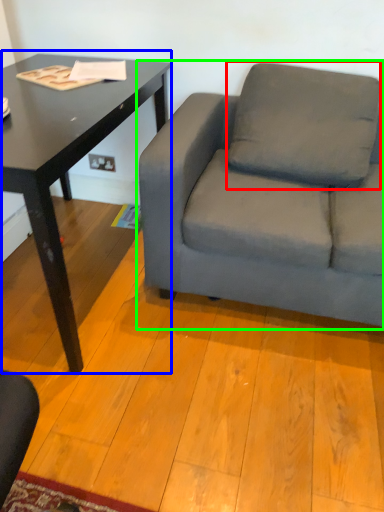
Question: Estimate the real-world distances between objects in this image. Which object is closer to pillow (highlighted by a red box), table (highlighted by a blue box) or studio couch (highlighted by a green box)?

Choices:
 (A) table
 (B) studio couch

Answer: (B)